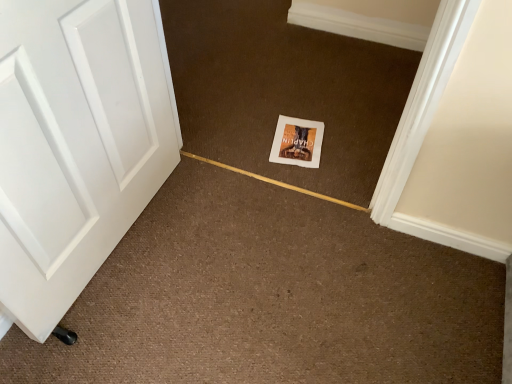
The height and width of the screenshot is (384, 512). I want to click on free space to the left of white paper postcard at center, so (251, 137).